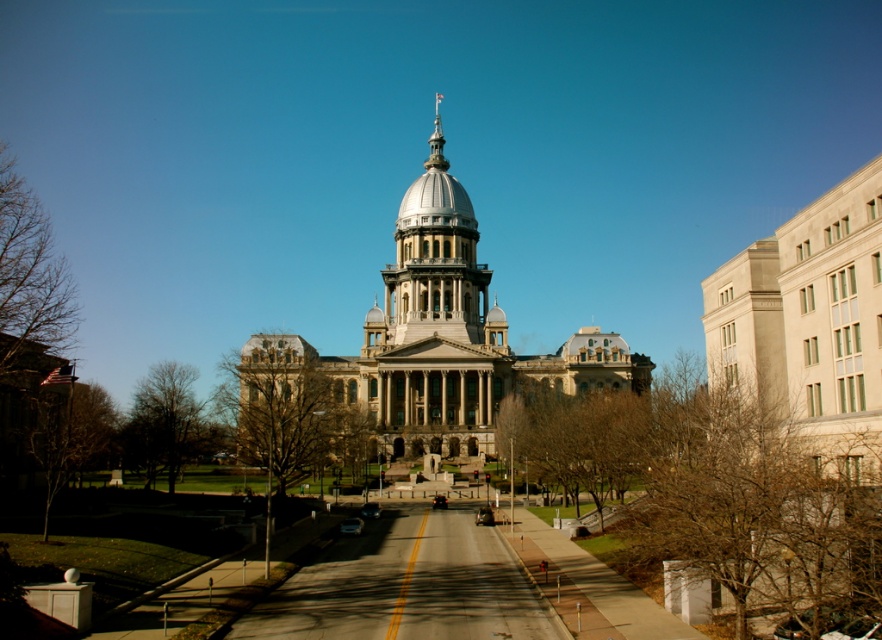
Measure the distance between point [449,211] and camera.

Point [449,211] and camera are 134.09 meters apart from each other.

Consider the image. Which is below, white marble dome at center or polished silver spire at center top?

white marble dome at center is below.

This screenshot has width=882, height=640. I want to click on white marble dome at center, so click(435, 202).

How far apart are beige stone tower at center and metallic silver car at center?

111.15 feet

Which is more to the left, beige stone tower at center or metallic silver car at center?

metallic silver car at center is more to the left.

Locate an element on the screen. This screenshot has height=640, width=882. beige stone tower at center is located at coordinates (450, 353).

The width and height of the screenshot is (882, 640). I want to click on beige stone tower at center, so click(450, 353).

Is point (427, 164) positioned before point (368, 508)?

No, (427, 164) is behind (368, 508).

Is polished silver spire at center top positioned behind shiny black sedan at center?

Yes, polished silver spire at center top is further from the viewer.

Locate an element on the screen. polished silver spire at center top is located at coordinates tap(436, 141).